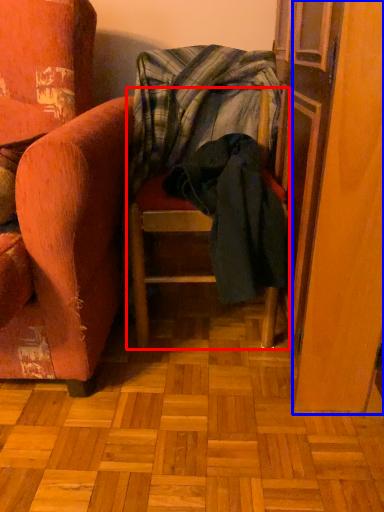
Question: Which object is closer to the camera taking this photo, furniture (highlighted by a red box) or screen door (highlighted by a blue box)?

Choices:
 (A) furniture
 (B) screen door

Answer: (B)